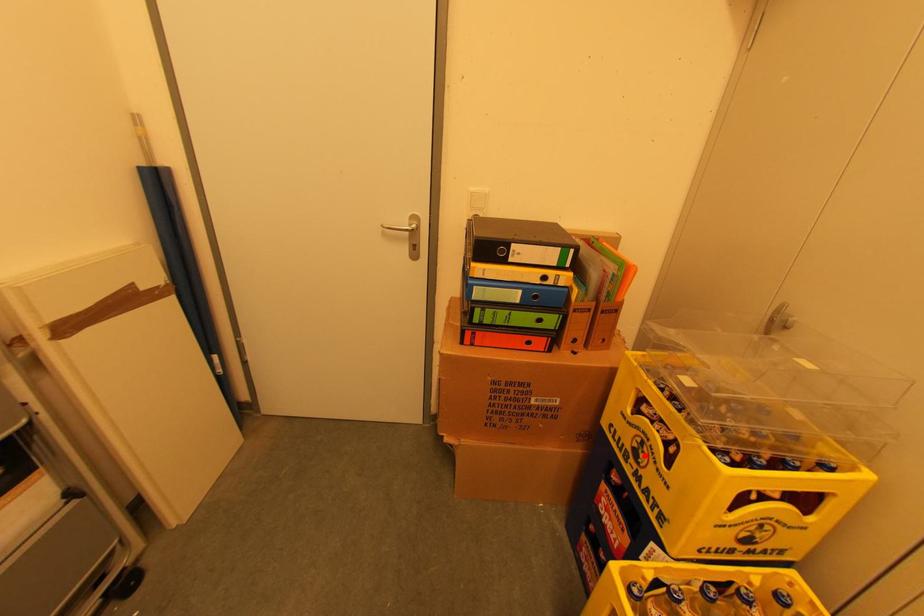
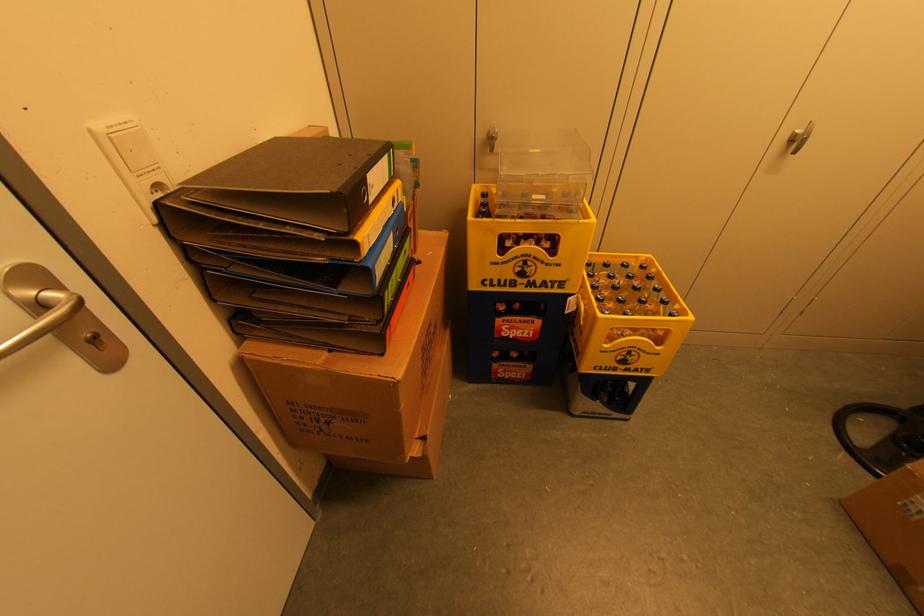
Where in the second image is the point corresponding to the highlighted location from the first image?

(530, 270)